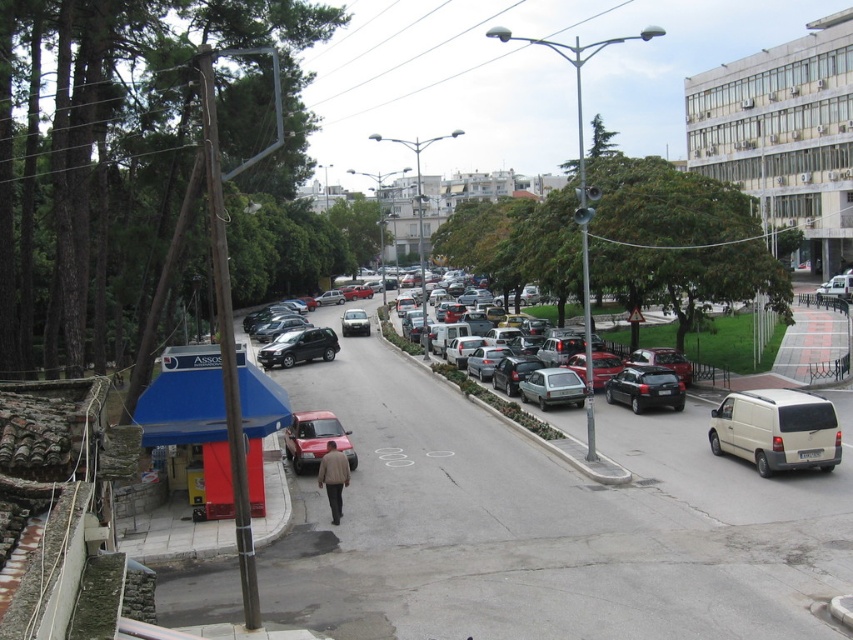
Is metallic red car at center to the left of matte red car at center from the viewer's perspective?

Incorrect, metallic red car at center is not on the left side of matte red car at center.

Can you confirm if metallic red car at center is positioned to the right of matte red car at center?

Answer: Indeed, metallic red car at center is positioned on the right side of matte red car at center.

Locate an element on the screen. This screenshot has width=853, height=640. metallic red car at center is located at coordinates (315, 440).

Find the location of a particular element. This screenshot has width=853, height=640. metallic red car at center is located at coordinates (315, 440).

Can you confirm if satin black hatchback at center is positioned below matte red car at center?

Correct, satin black hatchback at center is located below matte red car at center.

Does point (653, 365) come behind point (350, 330)?

No, (653, 365) is closer to viewer.

The image size is (853, 640). What are the coordinates of `satin black hatchback at center` in the screenshot? It's located at (645, 388).

Is point (726, 412) positioned behind point (323, 451)?

No, (726, 412) is closer to viewer.

Describe the element at coordinates (776, 429) in the screenshot. I see `white matte van at right` at that location.

At what (x,y) coordinates should I click in order to perform the action: click on white matte van at right. Please return your answer as a coordinate pair (x, y). Looking at the image, I should click on (776, 429).